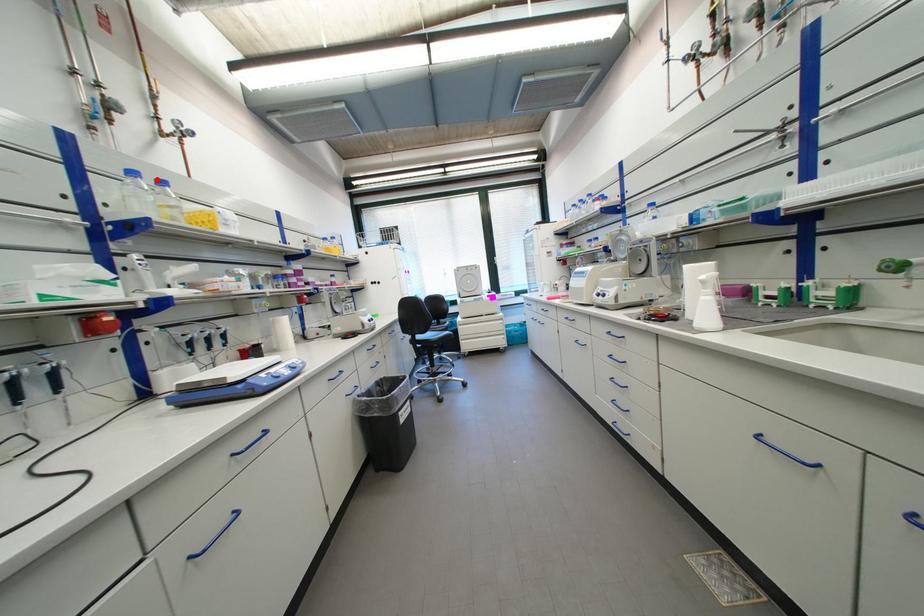
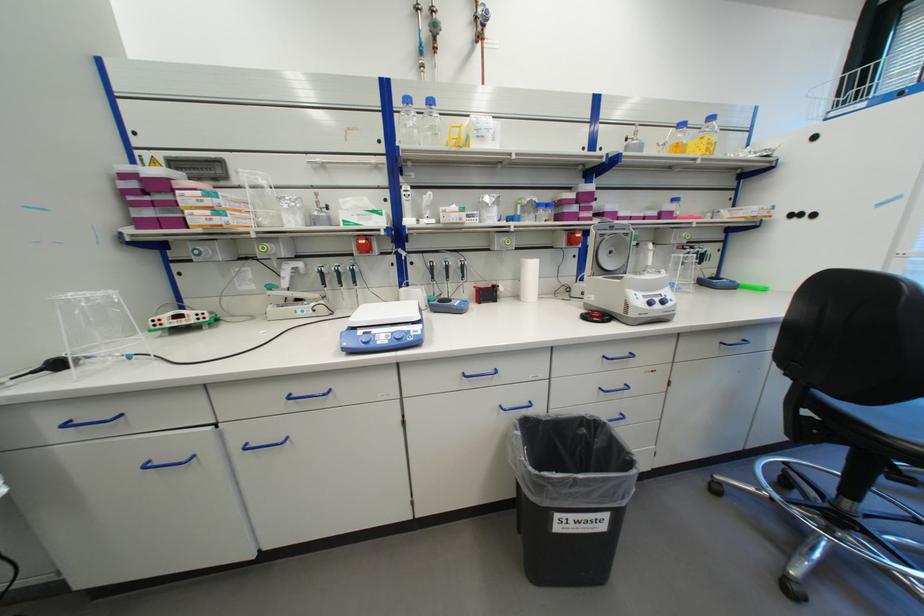
Where in the second image is the point corresponding to the highlighted location from the first image?

(428, 103)